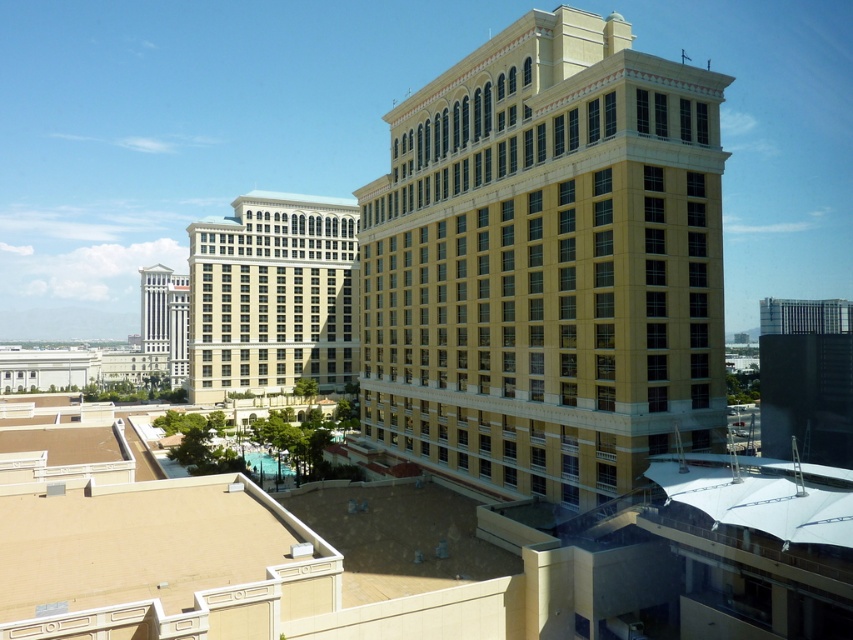
Question: Is yellow stone building at center wider than beige stone building at center-left?

Choices:
 (A) yes
 (B) no

Answer: (A)

Question: Which point appears farthest from the camera in this image?

Choices:
 (A) (567, 387)
 (B) (245, 224)

Answer: (B)

Question: Considering the relative positions of yellow stone building at center and beige stone building at center-left in the image provided, where is yellow stone building at center located with respect to beige stone building at center-left?

Choices:
 (A) left
 (B) right

Answer: (B)

Question: Which point is closer to the camera taking this photo?

Choices:
 (A) (402, 108)
 (B) (260, 246)

Answer: (A)

Question: Is yellow stone building at center positioned in front of beige stone building at center-left?

Choices:
 (A) yes
 (B) no

Answer: (A)